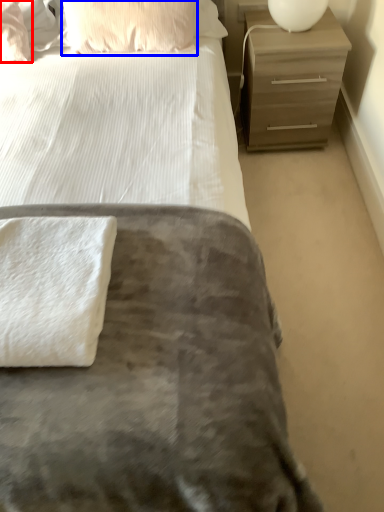
Question: Which point is closer to the camera, pillow (highlighted by a red box) or pillow (highlighted by a blue box)?

Choices:
 (A) pillow
 (B) pillow

Answer: (B)